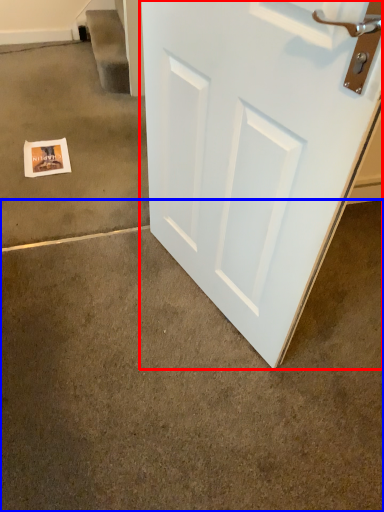
Question: Which point is closer to the camera, door (highlighted by a red box) or concrete (highlighted by a blue box)?

Choices:
 (A) door
 (B) concrete

Answer: (A)